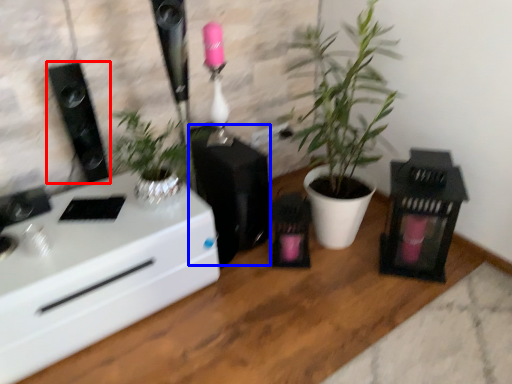
Question: Which object appears closest to the camera in this image, loudspeaker (highlighted by a red box) or appliance (highlighted by a blue box)?

Choices:
 (A) loudspeaker
 (B) appliance

Answer: (A)